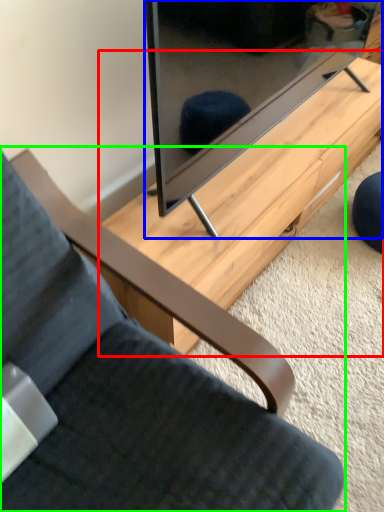
Question: Which object is positioned closest to table (highlighted by a red box)? Select from television (highlighted by a blue box) and chair (highlighted by a green box).

Choices:
 (A) television
 (B) chair

Answer: (A)